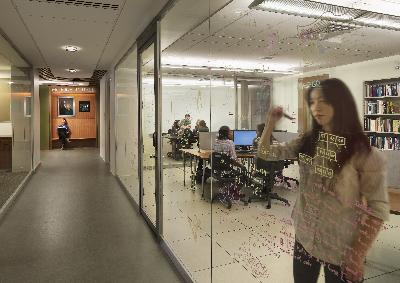
Locate an element on the screen. The image size is (400, 283). brown wall is located at coordinates (84, 124).